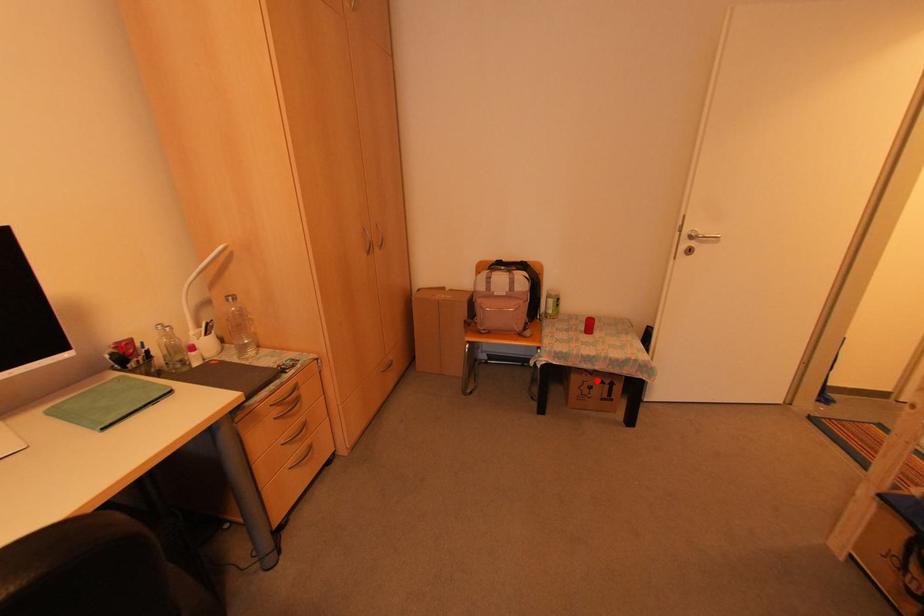
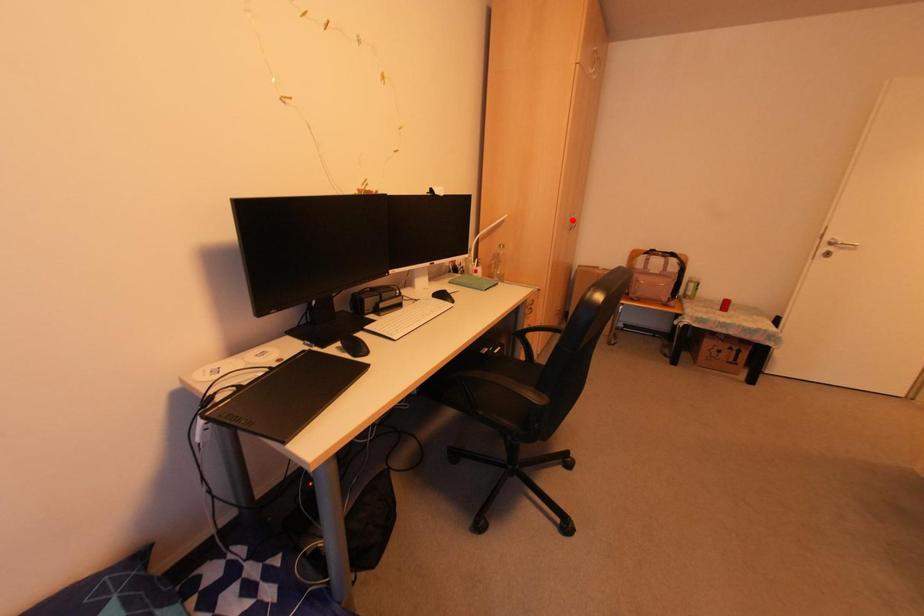
I am providing you with two images of the same scene from different viewpoints. A red point is marked on the first image and another point is marked on the second image. Does the point marked in image1 correspond to the same location as the one in image2?

No